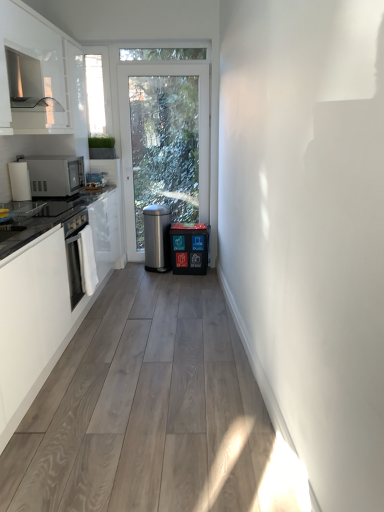
Question: Considering their positions, is white matte cabinet at left, the second cabinetry from the top, located in front of or behind metallic silver dishwasher at center?

Choices:
 (A) front
 (B) behind

Answer: (A)

Question: Would you say white matte cabinet at left, the first cabinetry from the bottom, is inside or outside metallic silver dishwasher at center?

Choices:
 (A) outside
 (B) inside

Answer: (A)

Question: Which is nearer to the white matte cabinet at left, the first cabinetry from the bottom?

Choices:
 (A) polished stainless steel trash can at center
 (B) white glossy cabinet at upper left, marked as the second cabinetry in a bottom-to-top arrangement
 (C) transparent glass window at upper left
 (D) metallic silver dishwasher at center
 (E) satin silver microwave at left

Answer: (E)

Question: Estimate the real-world distances between objects in this image. Which object is farther from the transparent glass window at upper left?

Choices:
 (A) white glossy cabinet at upper left, marked as the second cabinetry in a bottom-to-top arrangement
 (B) white matte cabinet at left, the second cabinetry from the top
 (C) metallic silver dishwasher at center
 (D) polished stainless steel trash can at center
 (E) satin silver microwave at left

Answer: (B)